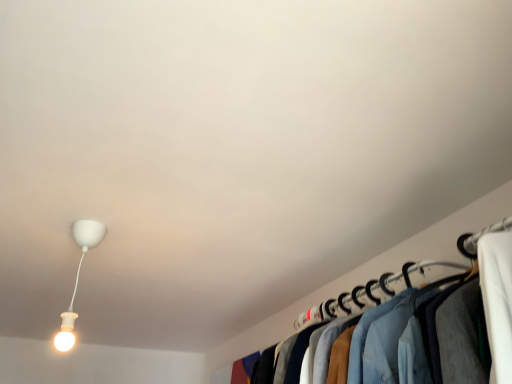
Question: From a real-world perspective, is denim jacket at right physically located above or below white matte lamp at upper left?

Choices:
 (A) below
 (B) above

Answer: (A)

Question: Is point (471, 233) closer or farther from the camera than point (93, 226)?

Choices:
 (A) farther
 (B) closer

Answer: (B)

Question: Considering the positions of denim jacket at right and white matte lamp at upper left in the image, is denim jacket at right wider or thinner than white matte lamp at upper left?

Choices:
 (A) wide
 (B) thin

Answer: (A)

Question: From their relative heights in the image, would you say white matte lamp at upper left is taller or shorter than denim jacket at right?

Choices:
 (A) tall
 (B) short

Answer: (A)

Question: Looking at their shapes, would you say white matte lamp at upper left is wider or thinner than denim jacket at right?

Choices:
 (A) wide
 (B) thin

Answer: (B)

Question: Is white matte lamp at upper left bigger or smaller than denim jacket at right?

Choices:
 (A) small
 (B) big

Answer: (A)

Question: From the image's perspective, relative to denim jacket at right, is white matte lamp at upper left above or below?

Choices:
 (A) below
 (B) above

Answer: (B)